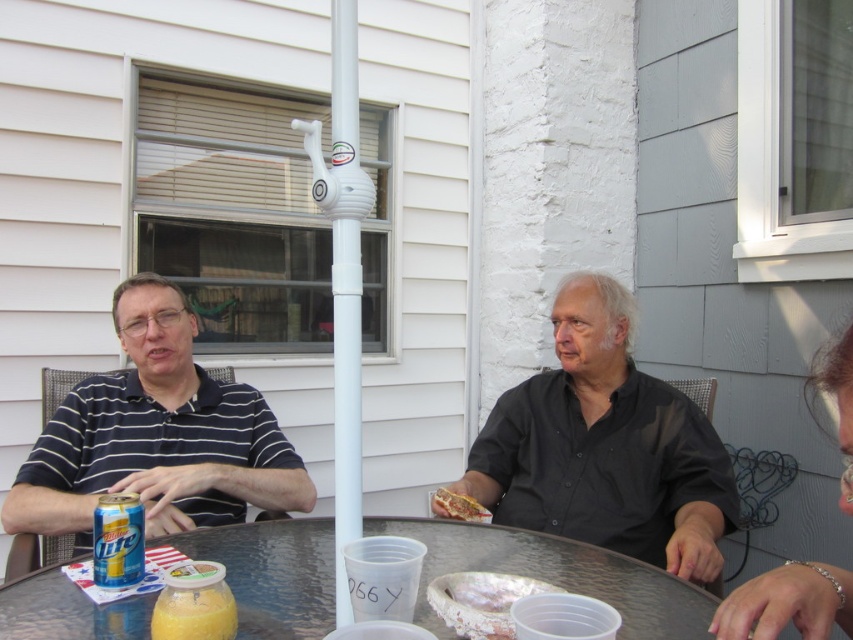
Question: Can you confirm if black matte shirt at center is wider than yellow metallic can at lower left?

Choices:
 (A) yes
 (B) no

Answer: (A)

Question: From the image, what is the correct spatial relationship of striped cotton shirt at left in relation to shiny metallic hot dog at center?

Choices:
 (A) right
 (B) left

Answer: (B)

Question: Can you confirm if translucent plastic table at center is positioned to the left of shiny silver foil at table center?

Choices:
 (A) yes
 (B) no

Answer: (A)

Question: Which point is closer to the camera taking this photo?

Choices:
 (A) (762, 624)
 (B) (490, 516)
 (C) (647, 529)

Answer: (A)

Question: Which object appears closest to the camera in this image?

Choices:
 (A) yellow matte jar at lower left
 (B) shiny silver foil at table center

Answer: (A)

Question: Which point is closer to the camera?

Choices:
 (A) (225, 556)
 (B) (485, 515)
 (C) (526, 586)

Answer: (C)